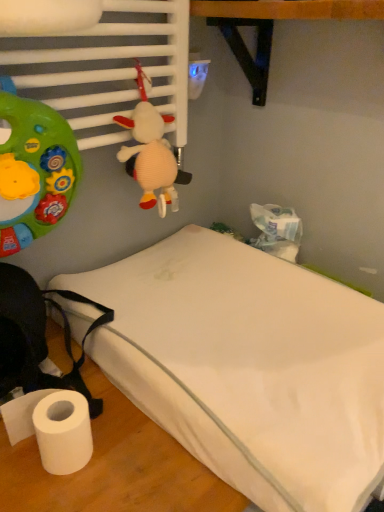
Question: From the image's perspective, is white fabric bed at lower left below plush beige at upper center?

Choices:
 (A) yes
 (B) no

Answer: (A)

Question: Is white fabric bed at lower left oriented away from plush beige at upper center?

Choices:
 (A) no
 (B) yes

Answer: (A)

Question: Is white fabric bed at lower left surrounding plush beige at upper center?

Choices:
 (A) no
 (B) yes

Answer: (A)

Question: From a real-world perspective, is white fabric bed at lower left located higher than plush beige at upper center?

Choices:
 (A) yes
 (B) no

Answer: (B)

Question: Does white fabric bed at lower left come in front of plush beige at upper center?

Choices:
 (A) no
 (B) yes

Answer: (B)

Question: Considering the relative positions of white fabric bed at lower left and plush beige at upper center in the image provided, is white fabric bed at lower left to the right of plush beige at upper center from the viewer's perspective?

Choices:
 (A) yes
 (B) no

Answer: (A)

Question: Considering the relative sizes of plush beige at upper center and white fabric bed at lower left in the image provided, is plush beige at upper center smaller than white fabric bed at lower left?

Choices:
 (A) no
 (B) yes

Answer: (B)

Question: Is plush beige at upper center thinner than white fabric bed at lower left?

Choices:
 (A) no
 (B) yes

Answer: (B)

Question: From the image's perspective, would you say plush beige at upper center is positioned over white fabric bed at lower left?

Choices:
 (A) yes
 (B) no

Answer: (A)

Question: Is plush beige at upper center taller than white fabric bed at lower left?

Choices:
 (A) yes
 (B) no

Answer: (A)

Question: Is plush beige at upper center facing away from white fabric bed at lower left?

Choices:
 (A) yes
 (B) no

Answer: (B)

Question: Considering the relative positions of plush beige at upper center and white fabric bed at lower left in the image provided, is plush beige at upper center behind white fabric bed at lower left?

Choices:
 (A) yes
 (B) no

Answer: (A)

Question: Considering the positions of point (150, 120) and point (274, 276), is point (150, 120) closer or farther from the camera than point (274, 276)?

Choices:
 (A) closer
 (B) farther

Answer: (A)